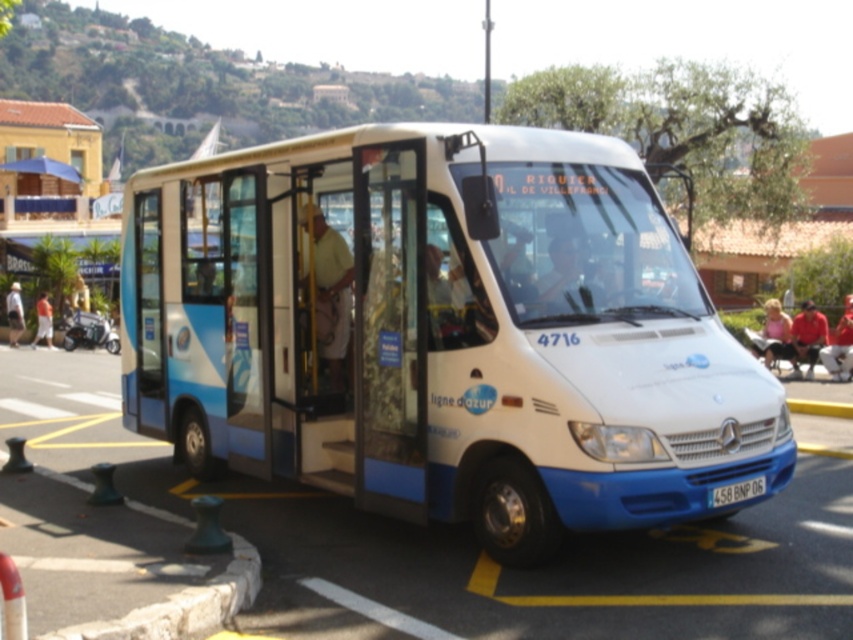
Question: Does white glossy van at center lie behind pink fabric at lower right?

Choices:
 (A) no
 (B) yes

Answer: (A)

Question: Can you confirm if light beige fabric pants at center is positioned to the left of matte blue bus at center?

Choices:
 (A) yes
 (B) no

Answer: (A)

Question: Can you confirm if light beige fabric pants at center is thinner than light blue fabric pants at left?

Choices:
 (A) no
 (B) yes

Answer: (B)

Question: Among these objects, which one is nearest to the camera?

Choices:
 (A) green concrete curb at lower left
 (B) red cotton shirt at center
 (C) light beige fabric pants at center
 (D) orange shirt at left

Answer: (A)

Question: Which object is closer to the camera taking this photo?

Choices:
 (A) white plastic license plate at center
 (B) light blue fabric pants at left
 (C) matte blue bus at center
 (D) red cotton shirt at center

Answer: (A)

Question: Which of the following is the closest to the observer?

Choices:
 (A) red cotton shirt at center
 (B) light beige fabric pants at center

Answer: (B)